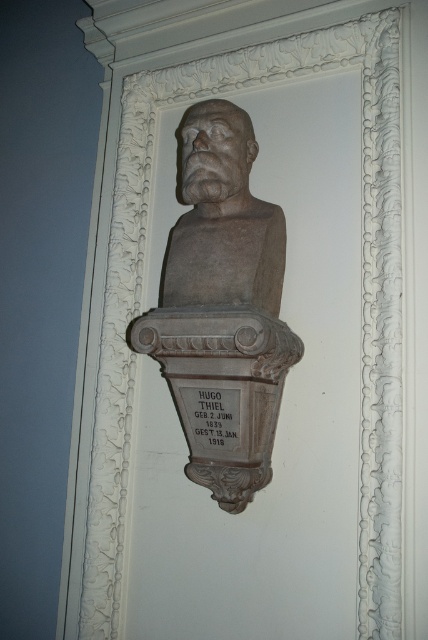
Does gray stone bust at center have a lesser width compared to matte stone bust at center?

Incorrect, gray stone bust at center's width is not less than matte stone bust at center's.

Is gray stone bust at center bigger than matte stone bust at center?

Yes.

Image resolution: width=428 pixels, height=640 pixels. In order to click on gray stone bust at center in this screenshot , I will do `click(222, 308)`.